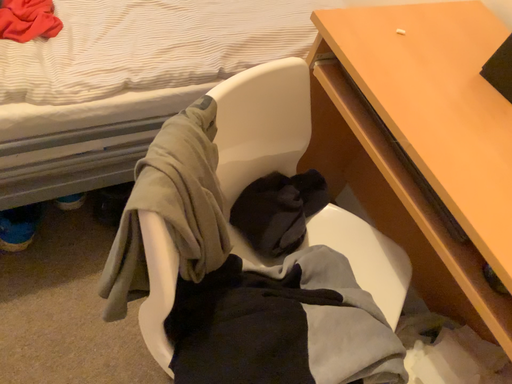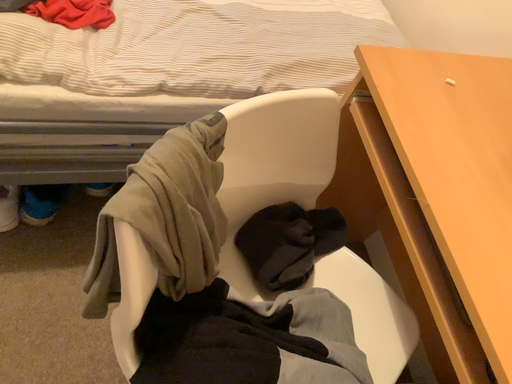
Question: Which way did the camera rotate in the video?

Choices:
 (A) rotated left
 (B) rotated right

Answer: (A)